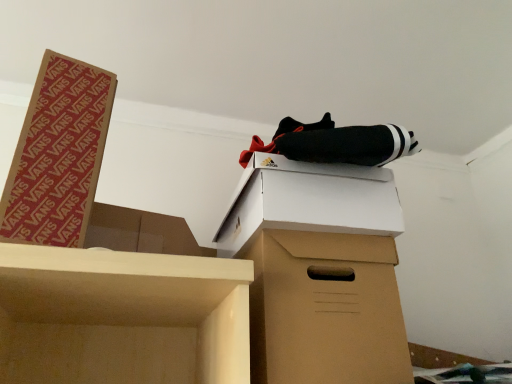
Question: From the image's perspective, is brown cardboard box at center above or below brown cardboard box at left, the first box from the left?

Choices:
 (A) below
 (B) above

Answer: (A)

Question: Is brown cardboard box at center wider or thinner than brown cardboard box at left, which ranks as the second box in right-to-left order?

Choices:
 (A) thin
 (B) wide

Answer: (B)

Question: Considering the real-world distances, which object is closest to the brown cardboard box at center?

Choices:
 (A) white cardboard box at upper center, which appears as the first box when viewed from the right
 (B) brown cardboard box at left, the first box from the left

Answer: (A)

Question: Which object is the farthest from the brown cardboard box at center?

Choices:
 (A) brown cardboard box at left, the first box from the left
 (B) white cardboard box at upper center, which appears as the first box when viewed from the right

Answer: (A)